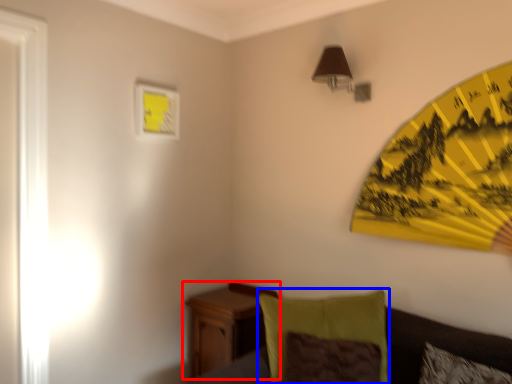
Question: Among these objects, which one is farthest to the camera, nightstand (highlighted by a red box) or pillow (highlighted by a blue box)?

Choices:
 (A) nightstand
 (B) pillow

Answer: (A)